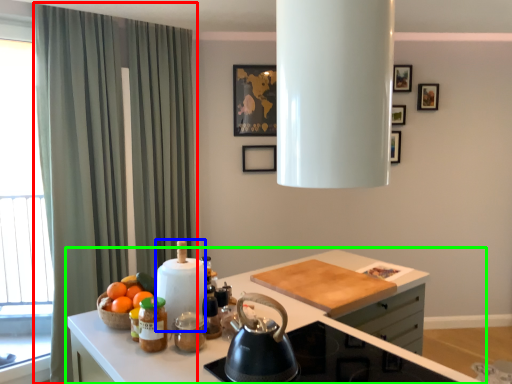
Question: Considering the real-world distances, which object is closest to curtain (highlighted by a red box)? appliance (highlighted by a blue box) or countertop (highlighted by a green box).

Choices:
 (A) appliance
 (B) countertop

Answer: (B)